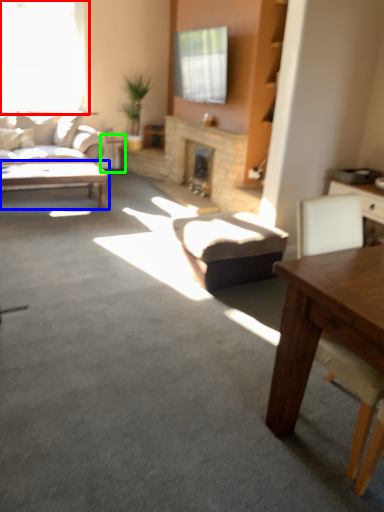
Question: Which object is the closest to the window (highlighted by a red box)? Choose among these: coffee table (highlighted by a blue box) or side table (highlighted by a green box).

Choices:
 (A) coffee table
 (B) side table

Answer: (B)